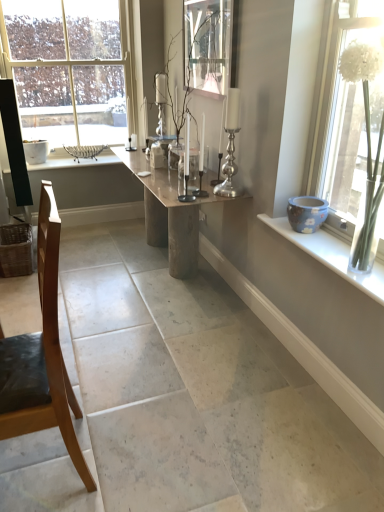
I want to click on vacant point to the right of light wood chair at left, so click(133, 452).